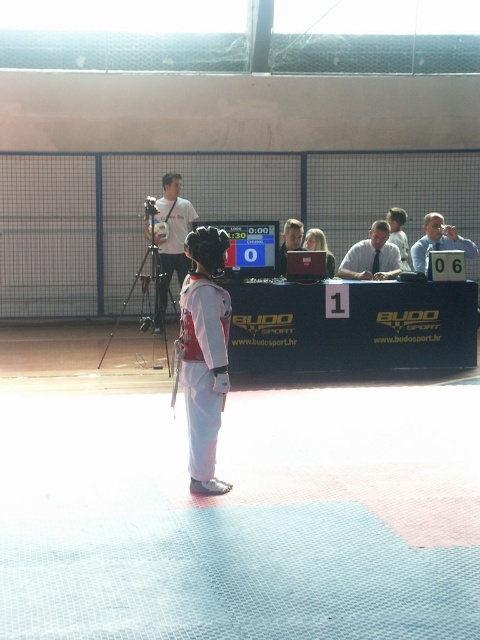
Question: Which of the following is the closest to the observer?

Choices:
 (A) light blue shirt at right
 (B) smooth brown hair at center
 (C) smooth skin face at center

Answer: (B)

Question: Does smooth skin face at center have a larger size compared to smooth brown hair at center?

Choices:
 (A) yes
 (B) no

Answer: (A)

Question: Is white shirt at center below light blue shirt at right?

Choices:
 (A) no
 (B) yes

Answer: (B)

Question: Which of the following is the closest to the observer?

Choices:
 (A) (403, 253)
 (B) (324, 243)
 (C) (285, 248)
 (D) (186, 332)

Answer: (D)

Question: Which of these objects is positioned farthest from the smooth brown hair at center?

Choices:
 (A) light blue shirt at right
 (B) light brown hair at upper center

Answer: (A)

Question: Does white matte karate robe at center appear on the right side of smooth skin face at center?

Choices:
 (A) no
 (B) yes

Answer: (A)